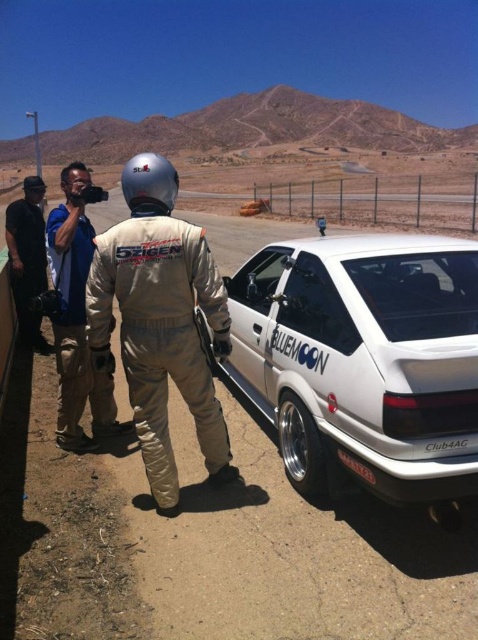
You are a photographer at the event and need to position yourself so that the white glossy hatchback at center is fully visible without being blocked by the black leather jacket at left. Based on their heights, is this possible?

The white glossy hatchback at center is shorter than the black leather jacket at left. Therefore, positioning yourself so the hatchback is fully visible without obstruction from the jacket is possible as the jacket is taller and can be moved or positioned accordingly.

You are a photographer trying to capture the white glossy hatchback at center and the black plastic license plate at lower center in a single shot. Since you want the license plate to be clearly visible, which object should you focus on first?

The white glossy hatchback at center is taller than the black plastic license plate at lower center. To ensure the license plate is clearly visible, focus on the white glossy hatchback at center first, as it is larger and will help frame the shot properly.

You are a photographer at the event and need to decide which jacket to wear for better visibility. The blue denim jacket at center and the black leather jacket at left are available. Which jacket would be more visible against the desert background?

The blue denim jacket at center would be more visible against the desert background because it is thinner than the black leather jacket at left, making it stand out more.